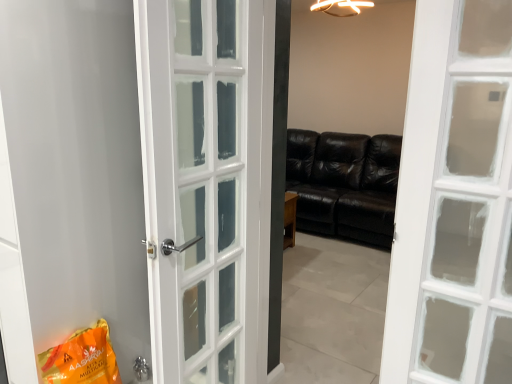
What do you see at coordinates (82, 358) in the screenshot?
I see `orange matte shopping bag at lower left` at bounding box center [82, 358].

Describe the element at coordinates (344, 184) in the screenshot. I see `black leather couch at center` at that location.

The image size is (512, 384). I want to click on orange matte shopping bag at lower left, so click(x=82, y=358).

From the picture: Is black leather couch at center far away from polished silver door handle at lower center?

black leather couch at center is positioned a significant distance from polished silver door handle at lower center.

At what (x,y) coordinates should I click in order to perform the action: click on studio couch above the polished silver door handle at lower center (from the image's perspective). Please return your answer as a coordinate pair (x, y). Looking at the image, I should click on (344, 184).

In the image, is black leather couch at center on the left side or the right side of polished silver door handle at lower center?

black leather couch at center is positioned on polished silver door handle at lower center's right side.

From a real-world perspective, is black leather couch at center positioned over polished silver door handle at lower center based on gravity?

Yes, from a real-world perspective, black leather couch at center is above polished silver door handle at lower center.

How different are the orientations of white glossy door at left and orange matte shopping bag at lower left in degrees?

The angular difference between white glossy door at left and orange matte shopping bag at lower left is 1.32 degrees.

Based on their positions, is white glossy door at left located to the left or right of orange matte shopping bag at lower left?

white glossy door at left is positioned on orange matte shopping bag at lower left's left side.

From a real-world perspective, does white glossy door at left sit lower than orange matte shopping bag at lower left?

No, from a real-world perspective, white glossy door at left is not beneath orange matte shopping bag at lower left.

Considering their positions, is white glossy door at left located in front of or behind orange matte shopping bag at lower left?

white glossy door at left is in front of orange matte shopping bag at lower left.

Based on their sizes in the image, would you say polished silver door handle at lower center is bigger or smaller than orange matte shopping bag at lower left?

polished silver door handle at lower center is smaller than orange matte shopping bag at lower left.

Is polished silver door handle at lower center inside or outside of orange matte shopping bag at lower left?

The correct answer is: outside.

Where is `door handle on the right of orange matte shopping bag at lower left`? door handle on the right of orange matte shopping bag at lower left is located at coordinates (142, 370).

Could you measure the distance between polished silver door handle at lower center and orange matte shopping bag at lower left?

The distance of polished silver door handle at lower center from orange matte shopping bag at lower left is 17.55 inches.

Is white glossy door at left inside the boundaries of polished silver door handle at lower center, or outside?

white glossy door at left is not inside polished silver door handle at lower center, it's outside.

Where is `screen door that appears above the polished silver door handle at lower center (from a real-world perspective)`? screen door that appears above the polished silver door handle at lower center (from a real-world perspective) is located at coordinates (70, 180).

Is white glossy door at left positioned far away from polished silver door handle at lower center?

white glossy door at left is actually quite close to polished silver door handle at lower center.

Can you confirm if white glossy door at left is smaller than polished silver door handle at lower center?

No, white glossy door at left is not smaller than polished silver door handle at lower center.

Is orange matte shopping bag at lower left positioned with its back to white glossy door at left?

No, white glossy door at left is not at the back of orange matte shopping bag at lower left.

Is orange matte shopping bag at lower left not within white glossy door at left?

Absolutely, orange matte shopping bag at lower left is external to white glossy door at left.

Which is further, (83, 371) or (122, 187)?

The point (122, 187) is farther from the camera.

Does point (355, 210) lie in front of point (120, 149)?

No, it is not.

Do you think black leather couch at center is within white glossy door at left, or outside of it?

black leather couch at center is outside white glossy door at left.

In the image, is black leather couch at center on the left side or the right side of white glossy door at left?

Clearly, black leather couch at center is on the right of white glossy door at left in the image.

From the picture: Considering the relative positions of black leather couch at center and white glossy door at left in the image provided, is black leather couch at center behind white glossy door at left?

Yes, it is.

Is orange matte shopping bag at lower left positioned far away from polished silver door handle at lower center?

orange matte shopping bag at lower left is actually quite close to polished silver door handle at lower center.

Does orange matte shopping bag at lower left lie in front of polished silver door handle at lower center?

Yes.

From the image's perspective, is orange matte shopping bag at lower left on polished silver door handle at lower center?

Yes, from the image's perspective, orange matte shopping bag at lower left is on top of polished silver door handle at lower center.

Is polished silver door handle at lower center located within orange matte shopping bag at lower left?

That's incorrect, polished silver door handle at lower center is not inside orange matte shopping bag at lower left.

Locate an element on the screen. The height and width of the screenshot is (384, 512). studio couch to the right of polished silver door handle at lower center is located at coordinates (344, 184).

This screenshot has height=384, width=512. In order to click on screen door located above the orange matte shopping bag at lower left (from a real-world perspective) in this screenshot , I will do pyautogui.click(x=70, y=180).

Estimate the real-world distances between objects in this image. Which object is further from polished silver door handle at lower center, black leather couch at center or orange matte shopping bag at lower left?

black leather couch at center is further to polished silver door handle at lower center.

Based on their spatial positions, is white glossy door at left or orange matte shopping bag at lower left closer to polished silver door handle at lower center?

The object closer to polished silver door handle at lower center is orange matte shopping bag at lower left.

Estimate the real-world distances between objects in this image. Which object is closer to orange matte shopping bag at lower left, white glossy door at left or black leather couch at center?

Among the two, white glossy door at left is located nearer to orange matte shopping bag at lower left.

Based on their spatial positions, is orange matte shopping bag at lower left or white glossy door at left further from polished silver door handle at lower center?

white glossy door at left is further to polished silver door handle at lower center.

Looking at the image, which one is located further to black leather couch at center, polished silver door handle at lower center or orange matte shopping bag at lower left?

orange matte shopping bag at lower left is positioned further to the anchor black leather couch at center.

From the image, which object appears to be nearer to white glossy door at left, polished silver door handle at lower center or black leather couch at center?

Among the two, polished silver door handle at lower center is located nearer to white glossy door at left.

From the image, which object appears to be nearer to polished silver door handle at lower center, black leather couch at center or white glossy door at left?

The object closer to polished silver door handle at lower center is white glossy door at left.

When comparing their distances from white glossy door at left, does black leather couch at center or polished silver door handle at lower center seem closer?

Based on the image, polished silver door handle at lower center appears to be nearer to white glossy door at left.

Identify the location of shopping bag between white glossy door at left and black leather couch at center from left to right. (82, 358).

Find the location of a particular element. This screenshot has width=512, height=384. door handle situated between white glossy door at left and black leather couch at center from left to right is located at coordinates (142, 370).

Where is `shopping bag between white glossy door at left and polished silver door handle at lower center from top to bottom`? The width and height of the screenshot is (512, 384). shopping bag between white glossy door at left and polished silver door handle at lower center from top to bottom is located at coordinates (82, 358).

Locate an element on the screen. The height and width of the screenshot is (384, 512). door handle between orange matte shopping bag at lower left and black leather couch at center in the front-back direction is located at coordinates (142, 370).